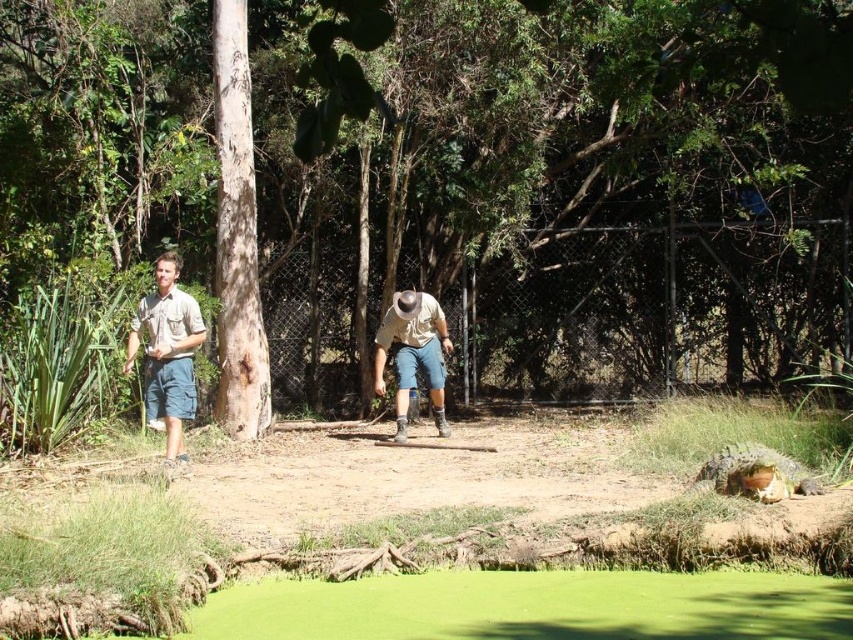
Question: Is brown rough tree at center wider than greenish-brown scaly crocodile at lower right?

Choices:
 (A) no
 (B) yes

Answer: (B)

Question: Which object appears farthest from the camera in this image?

Choices:
 (A) khaki cotton shirt at left
 (B) brown rough tree at center

Answer: (A)

Question: Considering the relative positions of brown rough tree at center and khaki cotton shirt at left in the image provided, where is brown rough tree at center located with respect to khaki cotton shirt at left?

Choices:
 (A) below
 (B) above

Answer: (B)

Question: Which object is positioned closest to the khaki cotton shirt at left?

Choices:
 (A) light brown leather boots at center
 (B) brown rough tree at center

Answer: (A)

Question: Which object is closer to the camera taking this photo?

Choices:
 (A) light brown leather boots at center
 (B) khaki cotton shirt at center
 (C) khaki cotton shirt at left
 (D) brown rough tree at center

Answer: (D)

Question: Where is brown rough tree at center located in relation to greenish-brown scaly crocodile at lower right in the image?

Choices:
 (A) left
 (B) right

Answer: (A)